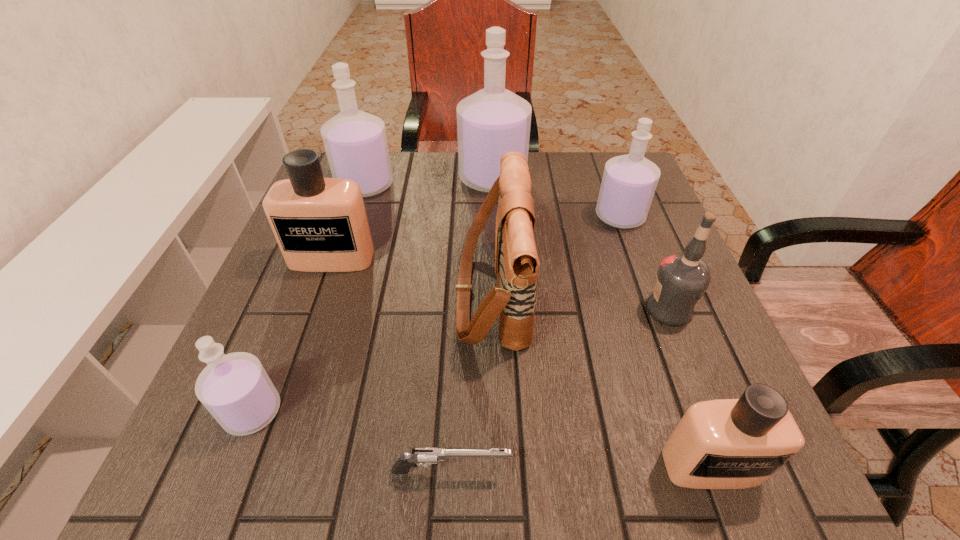
This screenshot has width=960, height=540. Identify the location of free space located on the front-facing side of the shoulder bag. (353, 293).

Find the location of `free location located on the front-facing side of the shoulder bag`. free location located on the front-facing side of the shoulder bag is located at coordinates (344, 293).

What are the coordinates of `vacant space positioned on the front label of the vodka` in the screenshot? It's located at (450, 309).

The height and width of the screenshot is (540, 960). In order to click on vacant region located 0.240m on the front label of the vodka in this screenshot , I will do `click(519, 309)`.

Where is `vacant space located 0.140m on the front label of the vodka`? The image size is (960, 540). vacant space located 0.140m on the front label of the vodka is located at coordinates (572, 309).

The image size is (960, 540). In order to click on vacant area situated on the back of the fifth farthest perfume in this screenshot , I will do `click(301, 289)`.

The width and height of the screenshot is (960, 540). In order to click on blank space located on the front-facing side of the silver pistol in this screenshot , I will do `click(644, 471)`.

I want to click on pistol situated at the near edge, so click(424, 456).

Image resolution: width=960 pixels, height=540 pixels. I want to click on vodka that is at the right edge, so click(682, 279).

Identify the location of object that is at the far left corner. This screenshot has width=960, height=540. (355, 142).